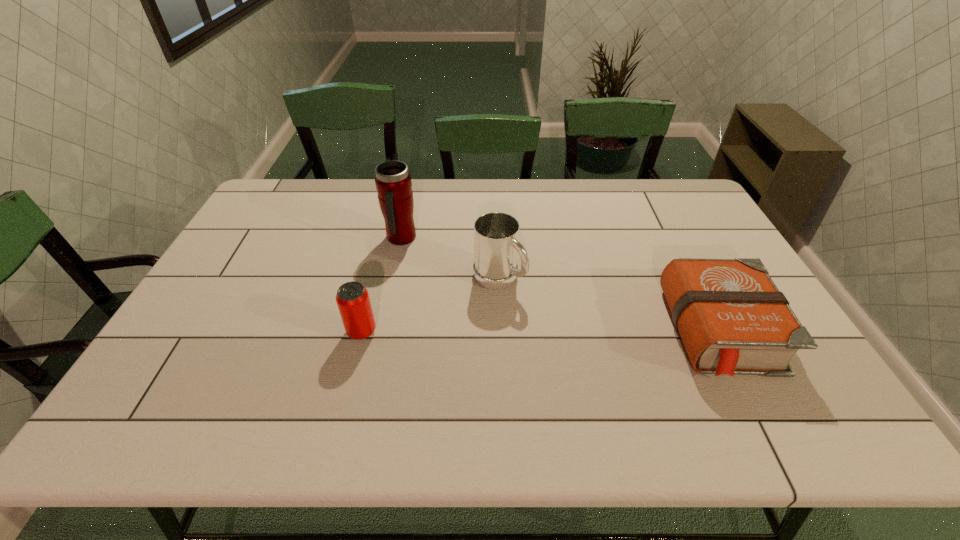
The image size is (960, 540). In the image, there is a desktop. Identify the location of free space at the left edge. (246, 255).

Where is `vacant area at the right edge`? vacant area at the right edge is located at coordinates (715, 223).

Where is `vacant area that lies between the third shortest object and the Bible`? This screenshot has height=540, width=960. vacant area that lies between the third shortest object and the Bible is located at coordinates (612, 305).

This screenshot has width=960, height=540. Identify the location of vacant space in between the Bible and the second tallest object. (612, 305).

Image resolution: width=960 pixels, height=540 pixels. Identify the location of free spot between the second shortest object and the rightmost object. (544, 332).

You are a GUI agent. You are given a task and a screenshot of the screen. Output one action in this format:
    pyautogui.click(x=<x>, y=<y>)
    Task: Click on the free space between the third tallest object and the third shortest object
    
    Given the screenshot: What is the action you would take?
    pyautogui.click(x=430, y=305)

At what (x,y) coordinates should I click in order to perform the action: click on vacant area that lies between the can and the second object from right to left. Please return your answer as a coordinate pair (x, y). Image resolution: width=960 pixels, height=540 pixels. Looking at the image, I should click on (430, 305).

Where is `free spot between the can and the second object from right to left`? Image resolution: width=960 pixels, height=540 pixels. free spot between the can and the second object from right to left is located at coordinates (430, 305).

What are the coordinates of `free space that is in between the rightmost object and the second shortest object` in the screenshot? It's located at (544, 332).

Where is `vacant area that lies between the rightmost object and the second shortest object`? vacant area that lies between the rightmost object and the second shortest object is located at coordinates (544, 332).